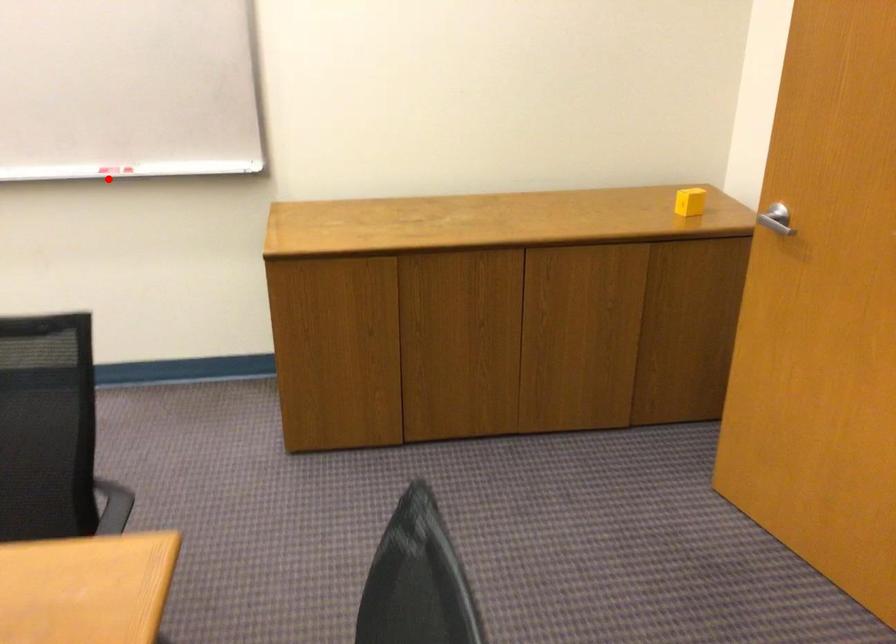
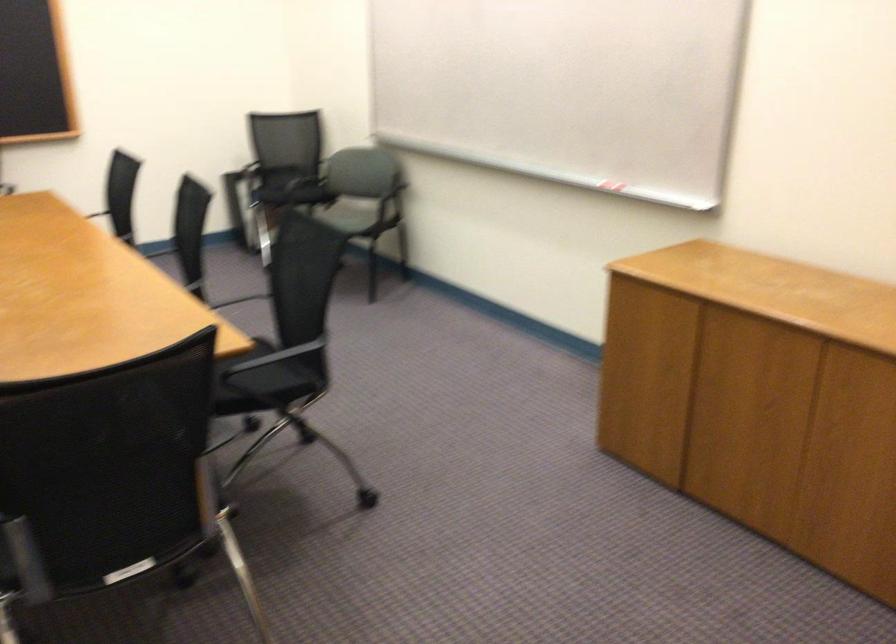
In the second image, find the point that corresponds to the highlighted location in the first image.

(608, 187)